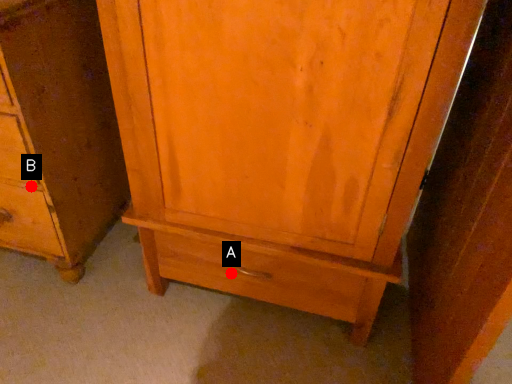
Question: Two points are circled on the image, labeled by A and B beside each circle. Which point is closer to the camera?

Choices:
 (A) A is closer
 (B) B is closer

Answer: (B)